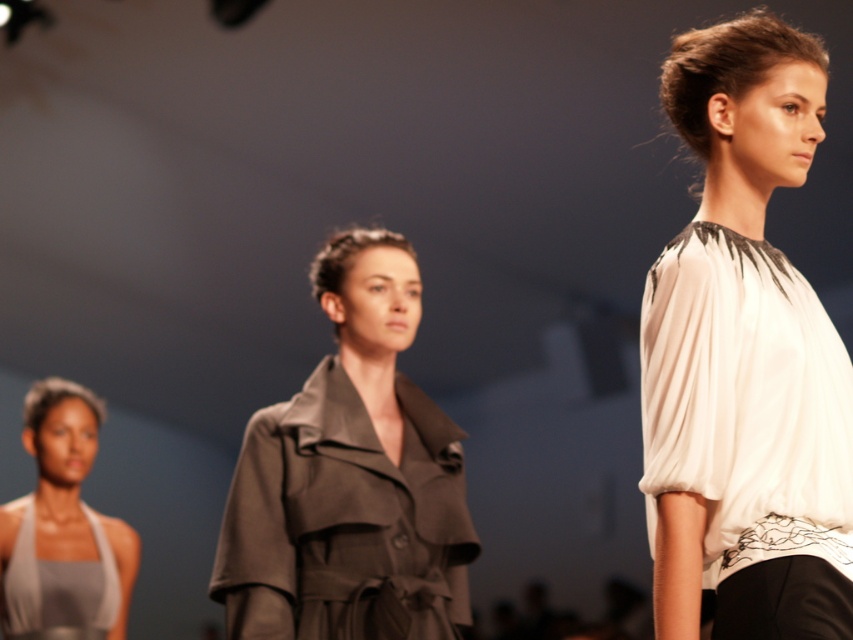
Is white silk blouse at right bigger than matte brown coat at center?

No.

Based on the photo, which is above, white silk blouse at right or matte brown coat at center?

Positioned higher is white silk blouse at right.

In order to click on white silk blouse at right in this screenshot , I will do pos(746,356).

Is white silk blouse at right closer to the viewer compared to matte gray halter top at lower left?

That is True.

Who is more distant from viewer, (805, 572) or (51, 616)?

The point (51, 616) is behind.

Where is `white silk blouse at right`? white silk blouse at right is located at coordinates (746, 356).

Looking at this image, does matte brown coat at center come behind matte gray halter top at lower left?

No, it is not.

From the picture: Who is shorter, matte brown coat at center or matte gray halter top at lower left?

With less height is matte gray halter top at lower left.

Describe the element at coordinates (350, 477) in the screenshot. I see `matte brown coat at center` at that location.

Find the location of a particular element. matte brown coat at center is located at coordinates (350, 477).